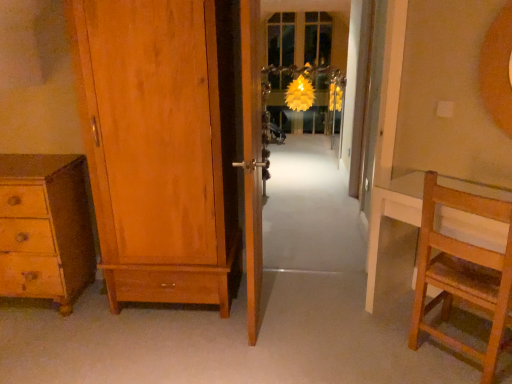
Locate an element on the screen. free location in front of wooden door at center, the 1th door in the right-to-left sequence is located at coordinates (258, 353).